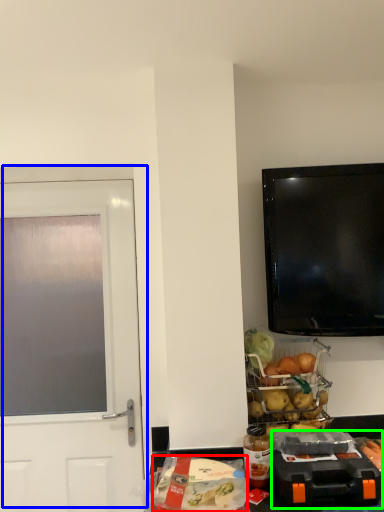
Question: Considering the real-world distances, which object is closest to food (highlighted by a red box)? door (highlighted by a blue box) or appliance (highlighted by a green box).

Choices:
 (A) door
 (B) appliance

Answer: (B)